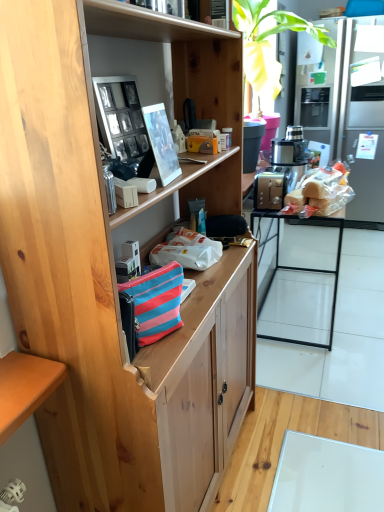
What is the approximate width of white glossy table at center?

The width of white glossy table at center is 37.34 inches.

What do you see at coordinates (108, 285) in the screenshot? This screenshot has height=512, width=384. I see `wooden cabinet at center` at bounding box center [108, 285].

Where is `silver metallic refrigerator at right`? This screenshot has width=384, height=512. silver metallic refrigerator at right is located at coordinates (349, 106).

Locate an element on the screen. translucent plastic bread at right is located at coordinates pos(325,190).

This screenshot has width=384, height=512. I want to click on white glossy table at center, so click(x=341, y=335).

Is the depth of metallic silver picture frame at upper left, which ranks as the 1th picture frame in left-to-right order, less than that of translucent plastic bread at right?

Yes.

From the picture: How many degrees apart are the facing directions of metallic silver picture frame at upper left, which ranks as the 1th picture frame in left-to-right order, and translucent plastic bread at right?

The facing directions of metallic silver picture frame at upper left, which ranks as the 1th picture frame in left-to-right order, and translucent plastic bread at right are 1.39 degrees apart.

From a real-world perspective, count 2nd picture frames upward from the translucent plastic bread at right and point to it. Please provide its 2D coordinates.

[(123, 121)]

From a real-world perspective, relative to translucent plastic bread at right, is metallic silver picture frame at upper left, which ranks as the 1th picture frame in left-to-right order, vertically above or below?

Clearly, from a real-world perspective, metallic silver picture frame at upper left, which ranks as the 1th picture frame in left-to-right order, is above translucent plastic bread at right.

Are metallic silver picture frame at upper left, which ranks as the 1th picture frame in left-to-right order, and striped fabric handbag at center far apart?

metallic silver picture frame at upper left, which ranks as the 1th picture frame in left-to-right order, is actually quite close to striped fabric handbag at center.

Considering the relative sizes of metallic silver picture frame at upper left, positioned as the second picture frame in right-to-left order, and striped fabric handbag at center in the image provided, is metallic silver picture frame at upper left, positioned as the second picture frame in right-to-left order, smaller than striped fabric handbag at center?

Actually, metallic silver picture frame at upper left, positioned as the second picture frame in right-to-left order, might be larger than striped fabric handbag at center.

Is the position of metallic silver picture frame at upper left, positioned as the second picture frame in right-to-left order, less distant than that of striped fabric handbag at center?

No, metallic silver picture frame at upper left, positioned as the second picture frame in right-to-left order, is further to the viewer.

From a real-world perspective, which is physically below, metallic silver picture frame at upper left, which ranks as the 1th picture frame in left-to-right order, or striped fabric handbag at center?

In real-world perspective, striped fabric handbag at center is lower.

Looking at this image, does white glossy table at center have a lesser height compared to wooden cabinet at center?

Indeed, white glossy table at center has a lesser height compared to wooden cabinet at center.

Between point (317, 268) and point (201, 354), which one is positioned behind?

The point (317, 268) is more distant.

Is white glossy table at center positioned with its back to wooden cabinet at center?

No, white glossy table at center's orientation is not away from wooden cabinet at center.

Is wooden cabinet at center outside of silver metallic refrigerator at right?

wooden cabinet at center lies outside silver metallic refrigerator at right's area.

Does wooden cabinet at center have a larger size compared to silver metallic refrigerator at right?

No, wooden cabinet at center is not bigger than silver metallic refrigerator at right.

How far apart are wooden cabinet at center and silver metallic refrigerator at right?

wooden cabinet at center and silver metallic refrigerator at right are 2.23 meters apart from each other.

Is wooden cabinet at center oriented away from silver metallic refrigerator at right?

wooden cabinet at center is not turned away from silver metallic refrigerator at right.

Considering the relative sizes of white glossy table at center and translucent plastic bread at right in the image provided, is white glossy table at center wider than translucent plastic bread at right?

Yes, white glossy table at center is wider than translucent plastic bread at right.

From a real-world perspective, is white glossy table at center located higher than translucent plastic bread at right?

No.

Does white glossy table at center have a greater height compared to translucent plastic bread at right?

In fact, white glossy table at center may be shorter than translucent plastic bread at right.

Considering the sizes of white glossy table at center and translucent plastic bread at right in the image, is white glossy table at center bigger or smaller than translucent plastic bread at right?

Clearly, white glossy table at center is larger in size than translucent plastic bread at right.

Which object is wider, silver metallic refrigerator at right or metallic silver picture frame at upper left, which ranks as the 1th picture frame in left-to-right order?

With larger width is silver metallic refrigerator at right.

Who is smaller, silver metallic refrigerator at right or metallic silver picture frame at upper left, which ranks as the 1th picture frame in left-to-right order?

metallic silver picture frame at upper left, which ranks as the 1th picture frame in left-to-right order.

In the image, there is a metallic silver picture frame at upper left, which ranks as the 1th picture frame in left-to-right order. Where is `refrigerator above it (from the image's perspective)`? refrigerator above it (from the image's perspective) is located at coordinates (349, 106).

Looking at this image, considering the positions of objects silver metallic refrigerator at right and metallic silver picture frame at upper left, which ranks as the 1th picture frame in left-to-right order, in the image provided, who is in front, silver metallic refrigerator at right or metallic silver picture frame at upper left, which ranks as the 1th picture frame in left-to-right order,?

metallic silver picture frame at upper left, which ranks as the 1th picture frame in left-to-right order, is closer to the camera.

Between point (273, 154) and point (296, 298), which one is positioned behind?

The point (296, 298) is behind.

Looking at the image, does metallic silver food processor at center-right seem bigger or smaller compared to white glossy table at center?

In the image, metallic silver food processor at center-right appears to be smaller than white glossy table at center.

From the image's perspective, between metallic silver food processor at center-right and white glossy table at center, which one is located above?

metallic silver food processor at center-right, from the image's perspective.

Find the location of a particular element. picture frame above the translucent plastic bread at right (from the image's perspective) is located at coordinates (123, 121).

The height and width of the screenshot is (512, 384). Identify the location of the 2nd picture frame behind the striped fabric handbag at center. (123, 121).

When comparing their distances from white glossy table at center, does wooden cabinet at center or silver metallic refrigerator at right seem closer?

Among the two, silver metallic refrigerator at right is located nearer to white glossy table at center.

From the image, which object appears to be nearer to wooden cabinet at center, silver metallic refrigerator at right or white glossy table at center?

Among the two, white glossy table at center is located nearer to wooden cabinet at center.

Considering their positions, is metallic silver food processor at center-right positioned further to white glossy table at center than matte plastic picture frame at upper center, arranged as the 1th picture frame when viewed from the right?

matte plastic picture frame at upper center, arranged as the 1th picture frame when viewed from the right, is further to white glossy table at center.

Based on their spatial positions, is metallic gold toaster at right or silver metallic refrigerator at right closer to metallic silver food processor at center-right?

Among the two, metallic gold toaster at right is located nearer to metallic silver food processor at center-right.

From the image, which object appears to be farther from striped fabric handbag at center, translucent plastic bread at right or metallic gold toaster at right?

metallic gold toaster at right lies further to striped fabric handbag at center than the other object.

From the image, which object appears to be farther from metallic silver food processor at center-right, matte plastic picture frame at upper center, acting as the second picture frame starting from the left, or metallic gold toaster at right?

Among the two, matte plastic picture frame at upper center, acting as the second picture frame starting from the left, is located further to metallic silver food processor at center-right.

Looking at this image, looking at the image, which one is located further to translucent plastic bread at right, metallic silver picture frame at upper left, which ranks as the 1th picture frame in left-to-right order, or white glossy table at center?

metallic silver picture frame at upper left, which ranks as the 1th picture frame in left-to-right order.

Looking at the image, which one is located closer to translucent plastic bread at right, wooden cabinet at center or striped fabric handbag at center?

wooden cabinet at center.

Where is `handbag between wooden cabinet at center and metallic gold toaster at right along the z-axis`? The height and width of the screenshot is (512, 384). handbag between wooden cabinet at center and metallic gold toaster at right along the z-axis is located at coordinates (156, 302).

At what (x,y) coordinates should I click in order to perform the action: click on desk between translucent plastic bread at right and silver metallic refrigerator at right in the front-back direction. Please return your answer as a coordinate pair (x, y). Looking at the image, I should click on (316, 272).

Where is `stuff between metallic silver food processor at center-right and metallic gold toaster at right in the vertical direction`? Image resolution: width=384 pixels, height=512 pixels. stuff between metallic silver food processor at center-right and metallic gold toaster at right in the vertical direction is located at coordinates (325, 190).

I want to click on stuff located between metallic silver picture frame at upper left, positioned as the second picture frame in right-to-left order, and white glossy table at center in the left-right direction, so click(325, 190).